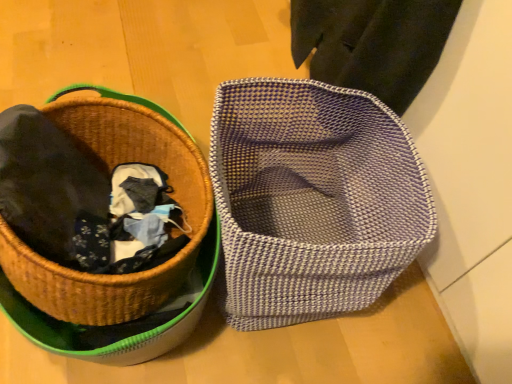
Identify the location of unoccupied space behind woven brown picnic basket at left. (134, 72).